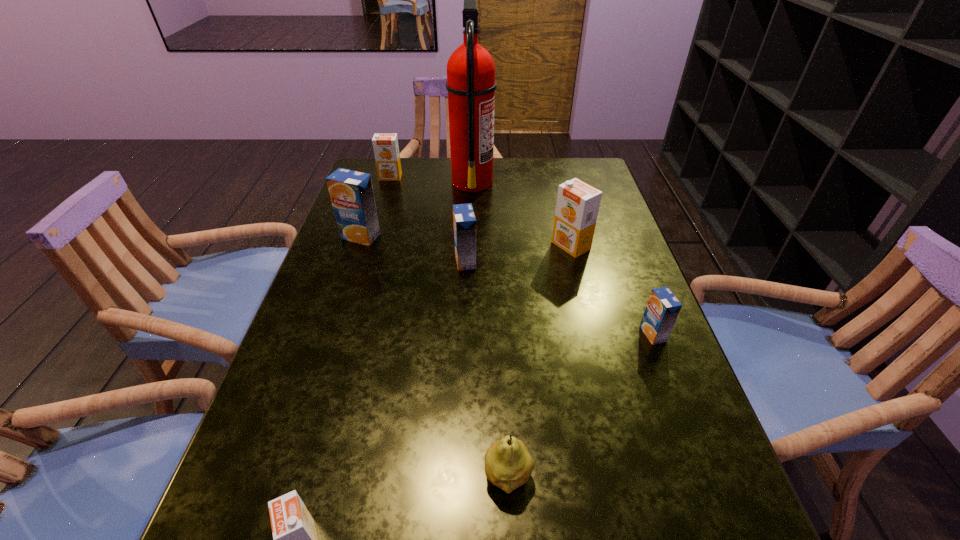
The image size is (960, 540). I want to click on orange juice positioned at the far edge, so click(x=386, y=150).

Image resolution: width=960 pixels, height=540 pixels. Find the location of `object located in the far left corner section of the desktop`. object located in the far left corner section of the desktop is located at coordinates point(386,150).

The image size is (960, 540). I want to click on free space at the far edge of the desktop, so click(x=434, y=168).

The width and height of the screenshot is (960, 540). I want to click on free space at the left edge, so click(252, 511).

You are a GUI agent. You are given a task and a screenshot of the screen. Output one action in this format:
    pyautogui.click(x=<x>, y=<y>)
    Task: Click on the free space at the right edge
    Image resolution: width=960 pixels, height=540 pixels.
    Given the screenshot: What is the action you would take?
    pyautogui.click(x=714, y=482)

The height and width of the screenshot is (540, 960). Find the location of `free space at the far right corner`. free space at the far right corner is located at coordinates (588, 183).

Identify the location of vacant area that lies between the fourth orange juice from left to right and the second orange juice from right to left. (518, 253).

The height and width of the screenshot is (540, 960). Find the location of `vacant region between the tallest object and the farthest orange juice`. vacant region between the tallest object and the farthest orange juice is located at coordinates (431, 179).

The image size is (960, 540). Find the location of `free space between the tallest object and the seventh farthest object`. free space between the tallest object and the seventh farthest object is located at coordinates (491, 329).

The image size is (960, 540). I want to click on vacant space in between the second biggest blue orange_juice and the second nearest orange juice, so click(559, 298).